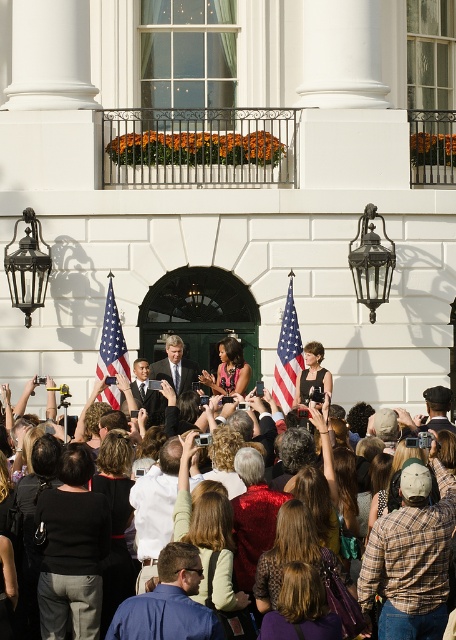
Looking at this image, you are a photographer at the event and want to take a photo of the dark suit at center without the matte american flag at center blocking it. How should you adjust your position?

The matte american flag at center is above the dark suit at center. To avoid the flag blocking the dark suit at center, you can lower your camera angle or move to a position where the flag is no longer in the line of sight between you and the dark suit at center.

You are standing in front of the grand white building and see the matte American flag at center. If you walk straight towards the flag, will you be facing away from the building?

The matte American flag at center is located at point (112, 340), which is in the central area of the scene. Since you are facing the building, walking straight towards the flag would mean moving forward towards the building, not away from it.

You are standing in the crowd at the formal outdoor event in front of the grand white building. You notice two points marked in the scene. Which point is closer to you, point (114, 356) or point (146, 371)?

Point (114, 356) is closer to you than point (146, 371).